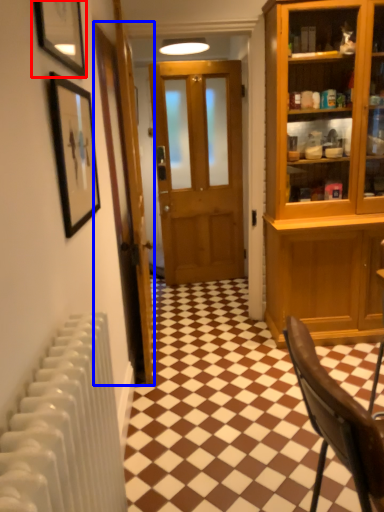
Question: Which of the following is the closest to the observer, picture frame (highlighted by a red box) or door (highlighted by a blue box)?

Choices:
 (A) picture frame
 (B) door

Answer: (A)